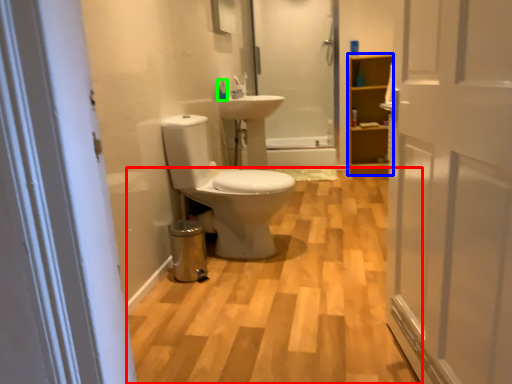
Question: Estimate the real-world distances between objects in this image. Which object is farther from plain (highlighted by a red box), cabinetry (highlighted by a blue box) or toiletry (highlighted by a green box)?

Choices:
 (A) cabinetry
 (B) toiletry

Answer: (A)